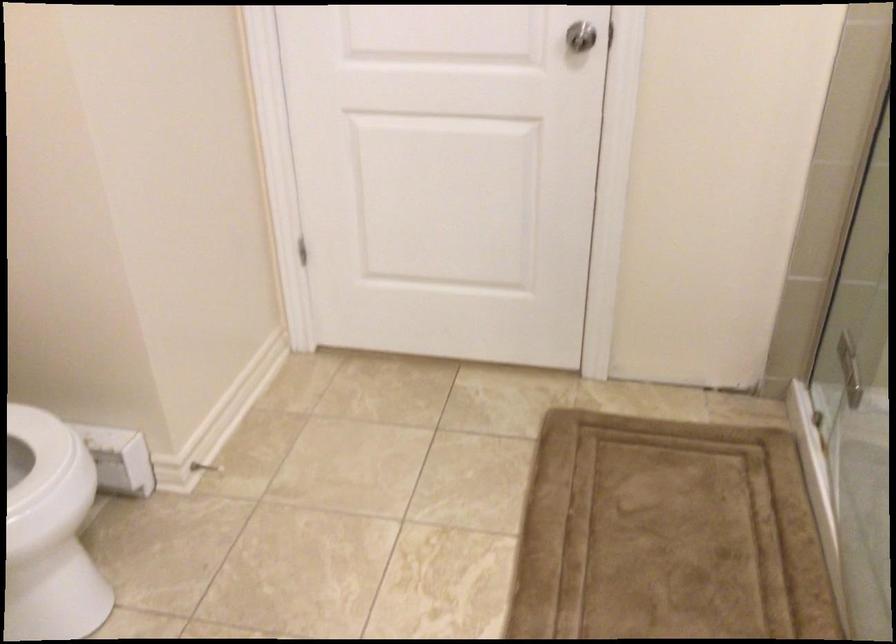
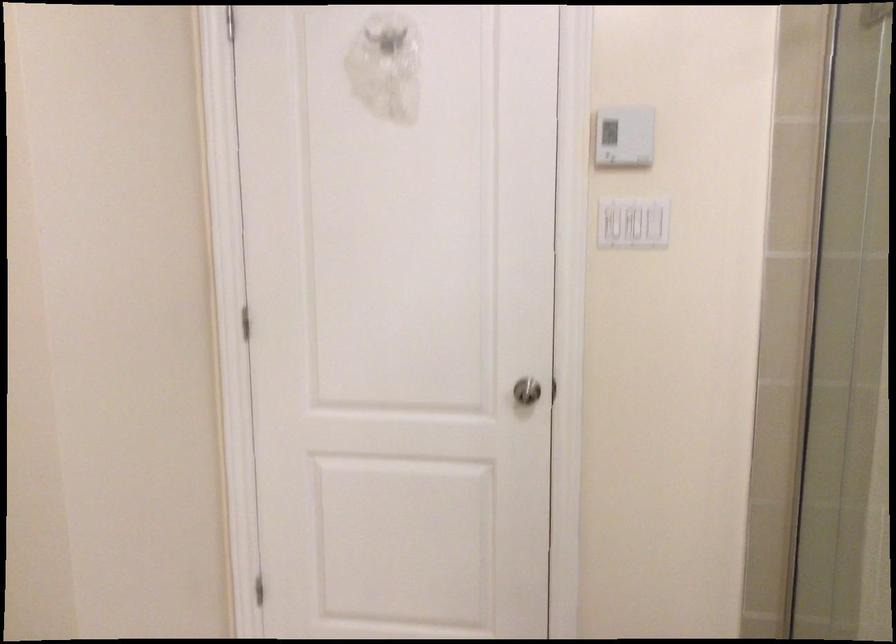
Question: The images are taken continuously from a first-person perspective. In which direction are you moving?

Choices:
 (A) Left
 (B) Right
 (C) Forward
 (D) Backward

Answer: (D)